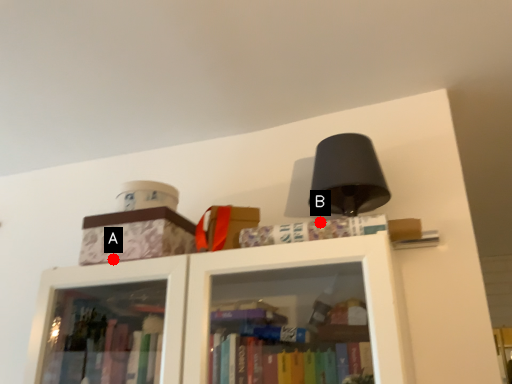
Question: Two points are circled on the image, labeled by A and B beside each circle. Among these points, which one is farthest from the camera?

Choices:
 (A) A is further
 (B) B is further

Answer: (B)